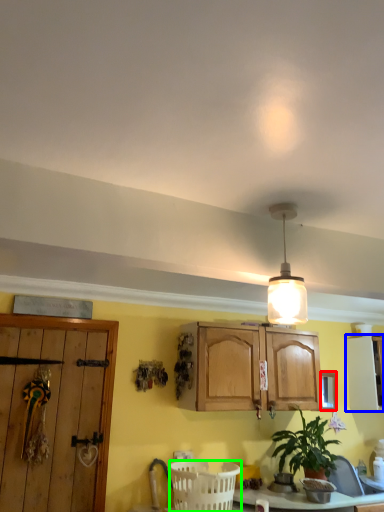
Question: Estimate the real-world distances between objects in this image. Which object is closer to window (highlighted by a red box), cabinetry (highlighted by a blue box) or basket (highlighted by a green box)?

Choices:
 (A) cabinetry
 (B) basket

Answer: (A)